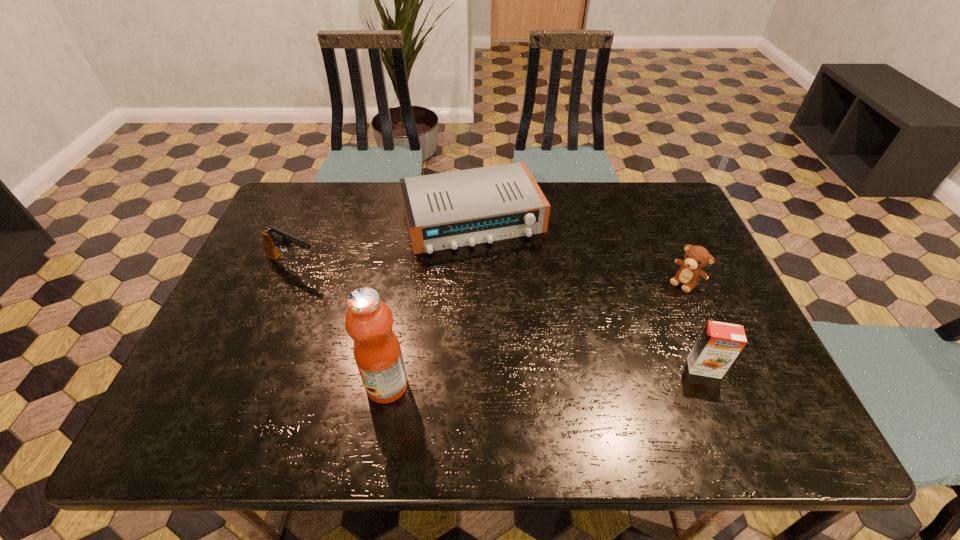
You are a GUI agent. You are given a task and a screenshot of the screen. Output one action in this format:
    pyautogui.click(x=<x>, y=<y>)
    Task: Click on the vacant space at the far right corner
    This screenshot has height=540, width=960.
    Given the screenshot: What is the action you would take?
    pyautogui.click(x=656, y=198)

This screenshot has width=960, height=540. What are the coordinates of `vacant region between the teddy bear and the leftmost object` in the screenshot? It's located at (489, 273).

Identify the location of free area in between the orange juice and the teddy bear. (694, 325).

Locate an element on the screen. The height and width of the screenshot is (540, 960). vacant area that lies between the radio receiver and the fruit juice is located at coordinates (430, 302).

Where is `free space between the teddy bear and the shortest object`? Image resolution: width=960 pixels, height=540 pixels. free space between the teddy bear and the shortest object is located at coordinates (579, 251).

Locate an element on the screen. This screenshot has height=540, width=960. vacant area that lies between the fruit juice and the shortest object is located at coordinates (430, 302).

The image size is (960, 540). In order to click on free spot between the gun and the radio receiver in this screenshot , I will do `click(383, 242)`.

This screenshot has height=540, width=960. Find the location of `vacant space in between the shortest object and the gun`. vacant space in between the shortest object and the gun is located at coordinates (383, 242).

You are a GUI agent. You are given a task and a screenshot of the screen. Output one action in this format:
    pyautogui.click(x=<x>, y=<y>)
    Task: Click on the vacant region between the gun and the orange juice
    This screenshot has height=540, width=960.
    Given the screenshot: What is the action you would take?
    pyautogui.click(x=498, y=316)

The image size is (960, 540). In order to click on unoccupied position between the teddy bear and the shortest object in this screenshot , I will do `click(579, 251)`.